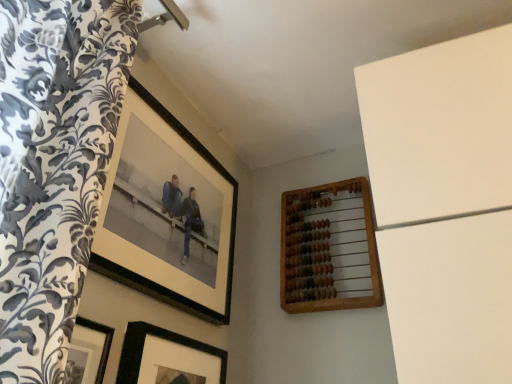
Question: Is black matte picture frame at upper left, which is the first picture frame in left-to-right order, taller or shorter than wooden abacus at upper right, which is counted as the 1th picture frame, starting from the right?

Choices:
 (A) tall
 (B) short

Answer: (A)

Question: Relative to wooden abacus at upper right, which is counted as the 1th picture frame, starting from the right, is black matte picture frame at upper left, which is the first picture frame in left-to-right order, in front or behind?

Choices:
 (A) front
 (B) behind

Answer: (A)

Question: Which object is positioned farthest from the black matte picture frame at upper left, marked as the third picture frame in a right-to-left arrangement?

Choices:
 (A) wooden abacus at upper right, arranged as the 3th picture frame when viewed from the left
 (B) black matte picture frame at lower center, which is counted as the second picture frame, starting from the right

Answer: (A)

Question: Which object is the farthest from the black matte picture frame at lower center, acting as the second picture frame starting from the left?

Choices:
 (A) wooden abacus at upper right, which is counted as the 1th picture frame, starting from the right
 (B) black matte picture frame at upper left, marked as the third picture frame in a right-to-left arrangement

Answer: (A)